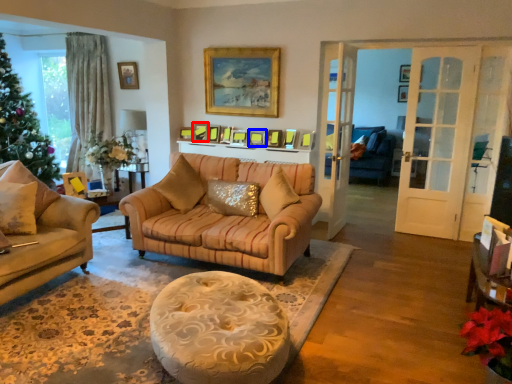
Question: Which of the following is the closest to the observer, picture frame (highlighted by a red box) or picture frame (highlighted by a blue box)?

Choices:
 (A) picture frame
 (B) picture frame

Answer: (B)